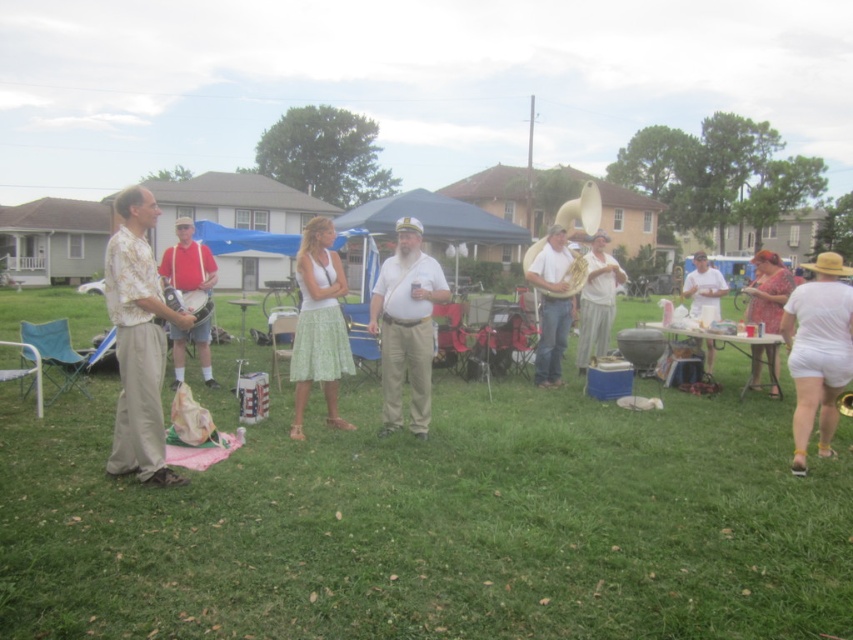
You are standing at the edge of the grassy area and want to walk towards the white cotton shirt at center. Which direction should you walk to avoid stepping on the green grass at center?

To reach the white cotton shirt at center without stepping on the green grass at center, walk to the right, as the green grass at center is located to the left of the white cotton shirt at center.